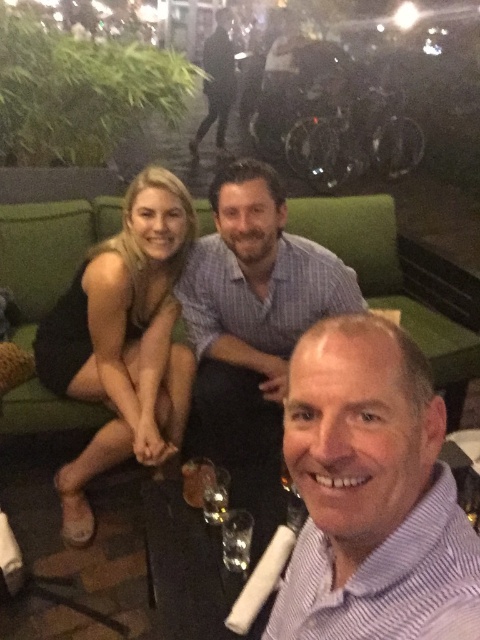
Question: Which of the following is the farthest from the observer?

Choices:
 (A) (112, 342)
 (B) (203, 499)
 (C) (462, 317)

Answer: (C)

Question: Considering the relative positions of purple striped shirt at center and striped cotton shirt at center in the image provided, where is purple striped shirt at center located with respect to striped cotton shirt at center?

Choices:
 (A) left
 (B) right

Answer: (B)

Question: Which point is farther to the camera?

Choices:
 (A) (58, 236)
 (B) (264, 264)

Answer: (A)

Question: Which point is closer to the camera?

Choices:
 (A) purple striped shirt at center
 (B) green fabric couch at center
 (C) clear glass wine glass at lower center

Answer: (A)

Question: Does purple striped shirt at center have a smaller size compared to green fabric couch at center?

Choices:
 (A) no
 (B) yes

Answer: (B)

Question: Where is purple striped shirt at center located in relation to striped cotton shirt at center in the image?

Choices:
 (A) below
 (B) above

Answer: (A)